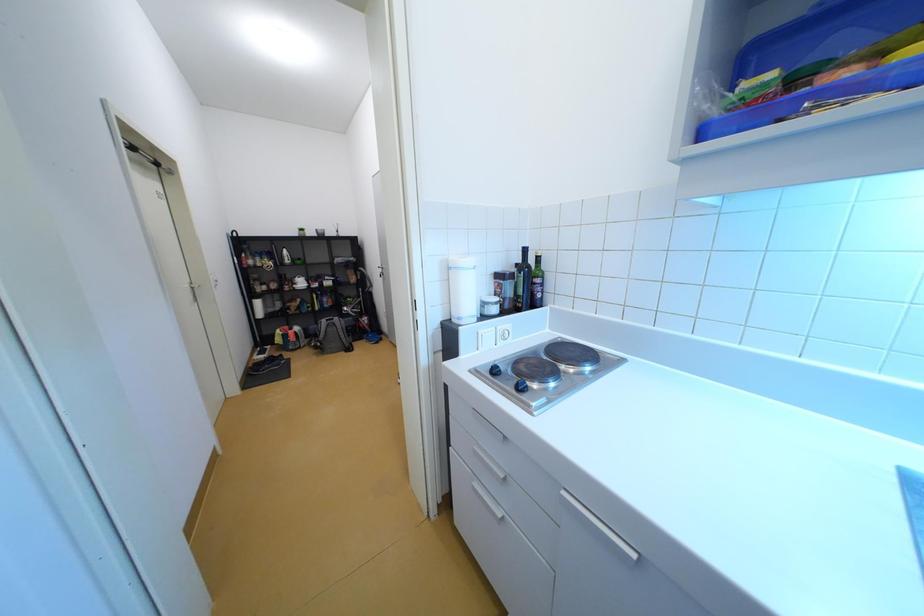
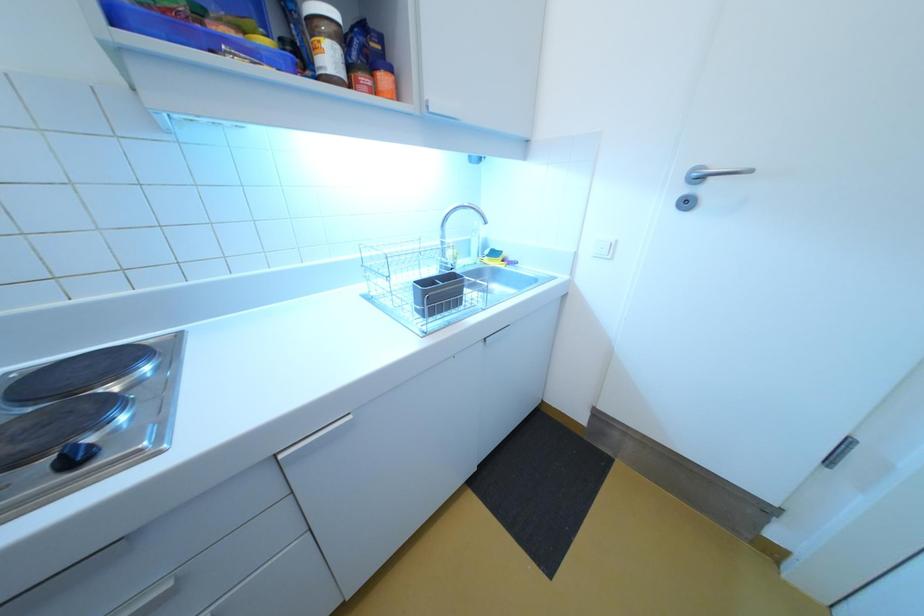
Based on the continuous images, in which direction is the camera rotating?

The camera's rotation is toward right-down.